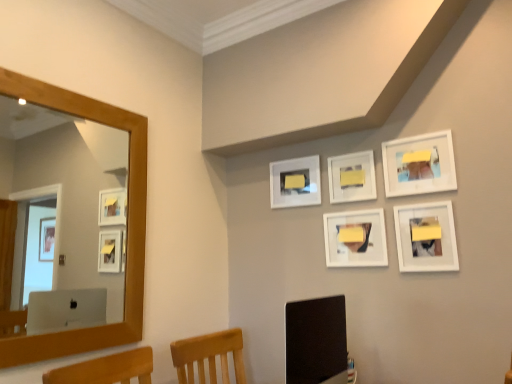
Question: Would you say white matte picture frame at upper center, which is the first picture frame in left-to-right order, is a long distance from white matte picture frame at center, arranged as the third picture frame when viewed from the right?

Choices:
 (A) yes
 (B) no

Answer: (B)

Question: From the image's perspective, would you say white matte picture frame at upper center, which is the first picture frame in left-to-right order, is shown under white matte picture frame at center, arranged as the third picture frame when viewed from the right?

Choices:
 (A) no
 (B) yes

Answer: (B)

Question: Does white matte picture frame at upper center, which is the first picture frame in left-to-right order, have a lesser height compared to white matte picture frame at center, arranged as the third picture frame when viewed from the right?

Choices:
 (A) yes
 (B) no

Answer: (B)

Question: Can you confirm if white matte picture frame at upper center, which is the first picture frame in left-to-right order, is wider than white matte picture frame at center, the third picture frame when ordered from left to right?

Choices:
 (A) no
 (B) yes

Answer: (A)

Question: Does white matte picture frame at upper center, which is the first picture frame in left-to-right order, touch white matte picture frame at center, arranged as the third picture frame when viewed from the right?

Choices:
 (A) yes
 (B) no

Answer: (B)

Question: Would you say white matte picture frame at upper center, which is the first picture frame in left-to-right order, is outside white matte picture frame at center, the third picture frame when ordered from left to right?

Choices:
 (A) yes
 (B) no

Answer: (A)

Question: Does white matte picture frame at lower right, the first picture frame positioned from the right, have a smaller size compared to white matte picture frame at upper right, acting as the fourth picture frame starting from the left?

Choices:
 (A) yes
 (B) no

Answer: (A)

Question: Is white matte picture frame at upper right, which is the 2th picture frame in right-to-left order, at the back of white matte picture frame at lower right, the 5th picture frame viewed from the left?

Choices:
 (A) no
 (B) yes

Answer: (A)

Question: From the image's perspective, is white matte picture frame at lower right, the first picture frame positioned from the right, over white matte picture frame at upper right, which is the 2th picture frame in right-to-left order?

Choices:
 (A) yes
 (B) no

Answer: (B)

Question: Is white matte picture frame at lower right, the first picture frame positioned from the right, far away from white matte picture frame at upper right, acting as the fourth picture frame starting from the left?

Choices:
 (A) no
 (B) yes

Answer: (A)

Question: Is white matte picture frame at lower right, the first picture frame positioned from the right, thinner than white matte picture frame at upper right, acting as the fourth picture frame starting from the left?

Choices:
 (A) no
 (B) yes

Answer: (B)

Question: Is white matte picture frame at lower right, the first picture frame positioned from the right, positioned beyond the bounds of white matte picture frame at upper right, which is the 2th picture frame in right-to-left order?

Choices:
 (A) no
 (B) yes

Answer: (B)

Question: Is white matte picture frame at lower right, the first picture frame positioned from the right, further to the viewer compared to matte black monitor at lower center?

Choices:
 (A) no
 (B) yes

Answer: (B)